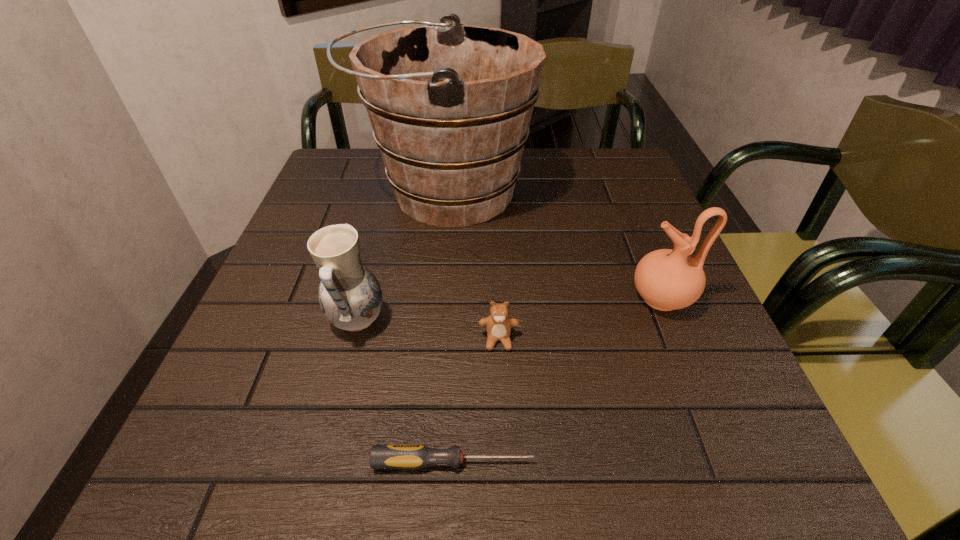
Where is `the farthest object`? the farthest object is located at coordinates (450, 105).

Find the location of a particular element. the tallest object is located at coordinates (450, 105).

Where is `the right pottery`? the right pottery is located at coordinates (666, 279).

Image resolution: width=960 pixels, height=540 pixels. I want to click on the left pottery, so click(x=350, y=297).

The image size is (960, 540). Identify the location of teddy bear. (498, 325).

In order to click on the shortest object in this screenshot , I will do `click(415, 456)`.

Where is `screwdriver`? The height and width of the screenshot is (540, 960). screwdriver is located at coordinates (415, 456).

Locate an element on the screen. This screenshot has height=540, width=960. vacant space situated 0.070m on the handle side of the bucket is located at coordinates (331, 191).

Find the location of a particular element. This screenshot has height=540, width=960. vacant region located on the handle side of the bucket is located at coordinates (324, 191).

Where is `vacant space located 0.050m on the spout of the right pottery`? The height and width of the screenshot is (540, 960). vacant space located 0.050m on the spout of the right pottery is located at coordinates (605, 298).